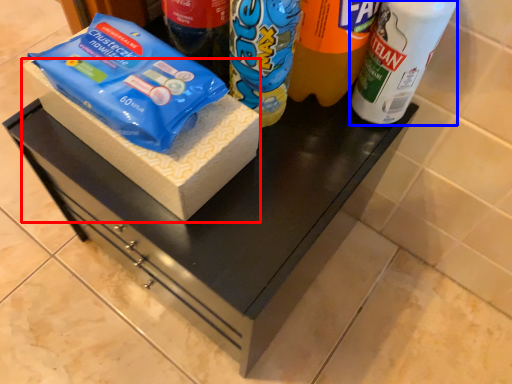
Question: Which object is closer to the camera taking this photo, box (highlighted by a red box) or bottle (highlighted by a blue box)?

Choices:
 (A) box
 (B) bottle

Answer: (B)